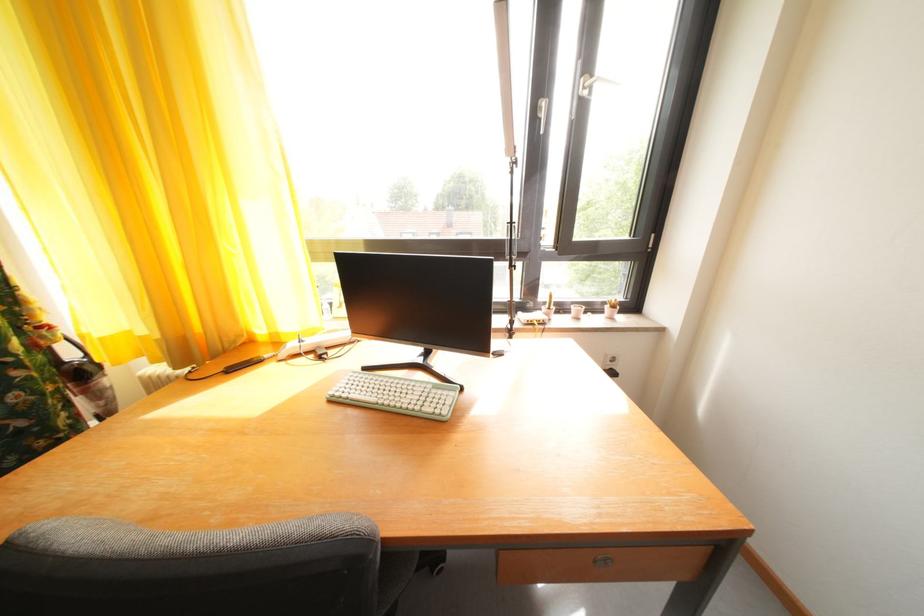
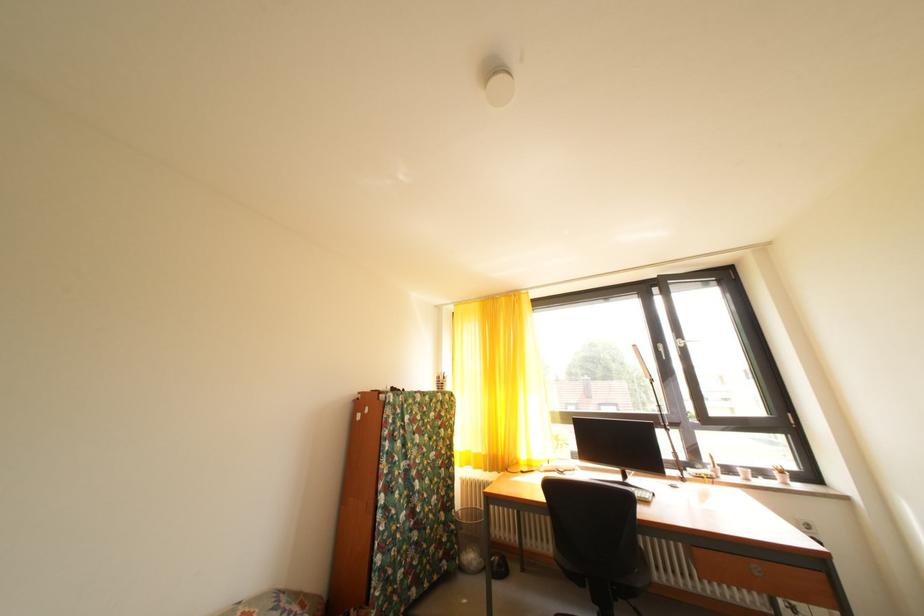
Locate, in the second image, the point that corresponds to point (616, 313) in the first image.

(784, 479)